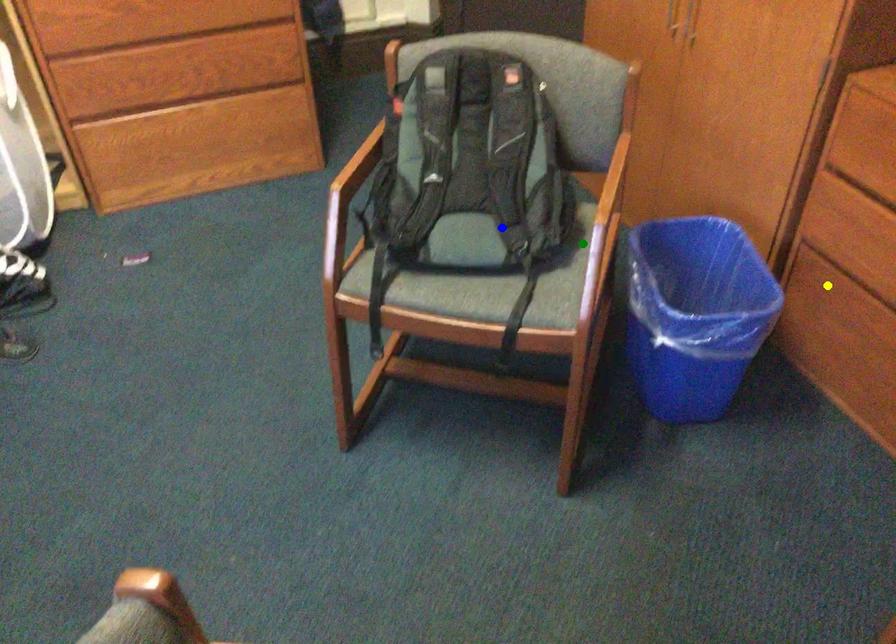
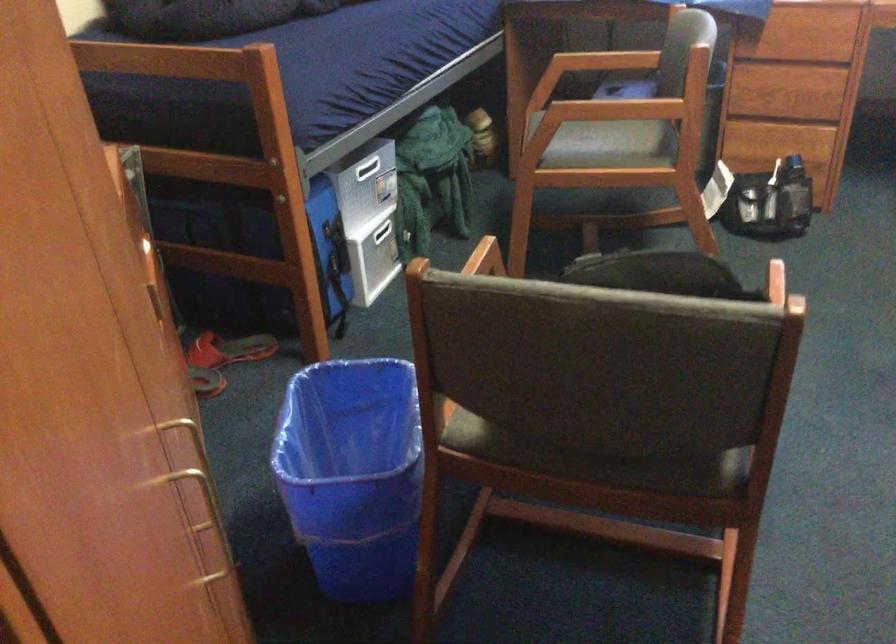
I am providing you with two images of the same scene from different viewpoints. Three points are marked in image1. Which point corresponds to a part or object that is occluded in image2?In image1, three points are marked. Which of them correspond to a part or object that is occluded in image2?Among the three points shown in image1, which one corresponds to a part or object that is no longer visible due to occlusion in image2?

yellow point cannot be seen in image2.